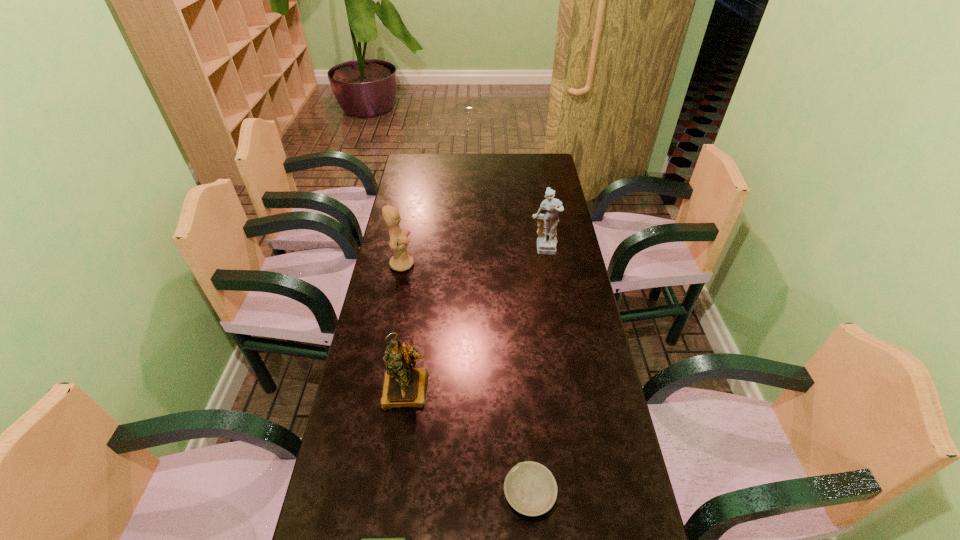
Locate which figurine ranks third in proximity to the bowl. Please provide its 2D coordinates. Your answer should be formatted as a tuple, i.e. [(x, y)], where the tuple contains the x and y coordinates of a point satisfying the conditions above.

[(547, 223)]

Find the location of a particular element. free region that satisfies the following two spatial constraints: 1. on the front-facing side of the nearest figurine; 2. on the right side of the second object from right to left is located at coordinates click(x=393, y=494).

Image resolution: width=960 pixels, height=540 pixels. I want to click on vacant point that satisfies the following two spatial constraints: 1. on the front-facing side of the second object from right to left; 2. on the left side of the third farthest object, so click(393, 494).